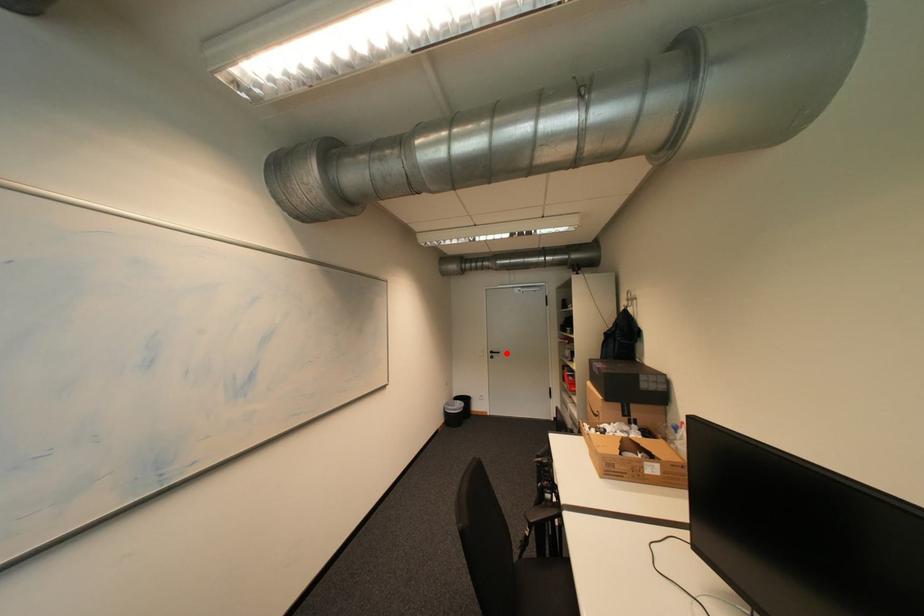
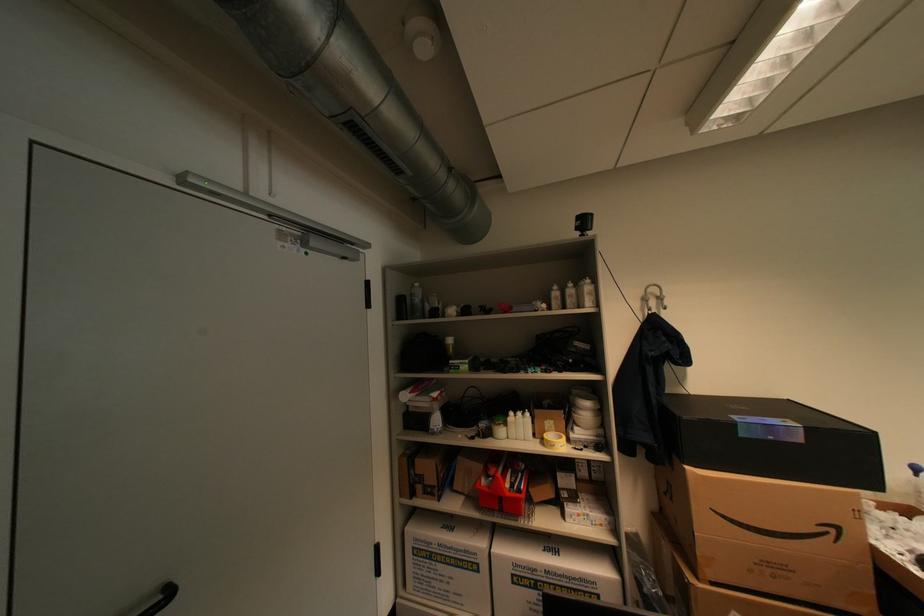
Question: I am providing you with two images of the same scene from different viewpoints. Image1 has a red point marked. In image2, the corresponding 3D location appears at what relative position? Reply with the corresponding letter.

Choices:
 (A) Closer
 (B) Farther

Answer: (A)